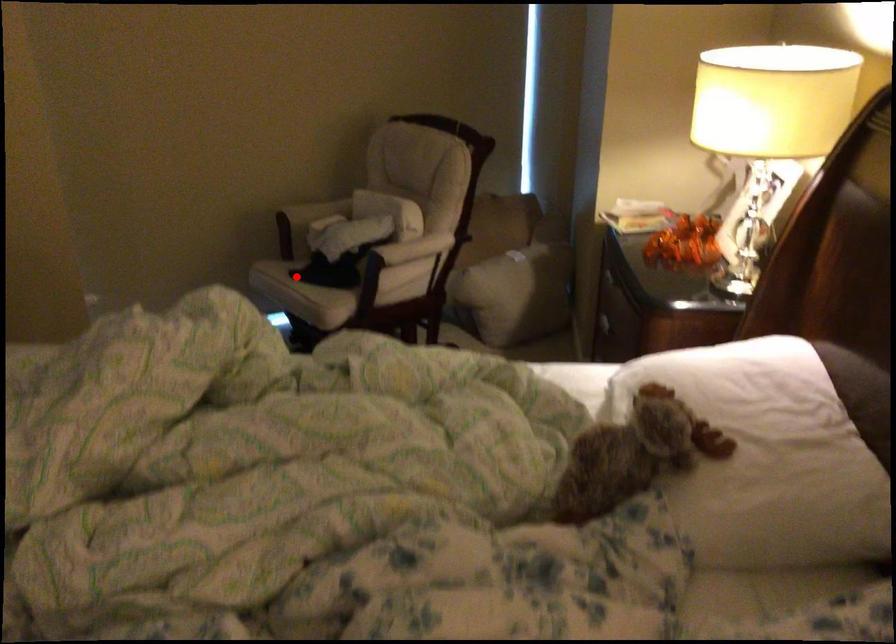
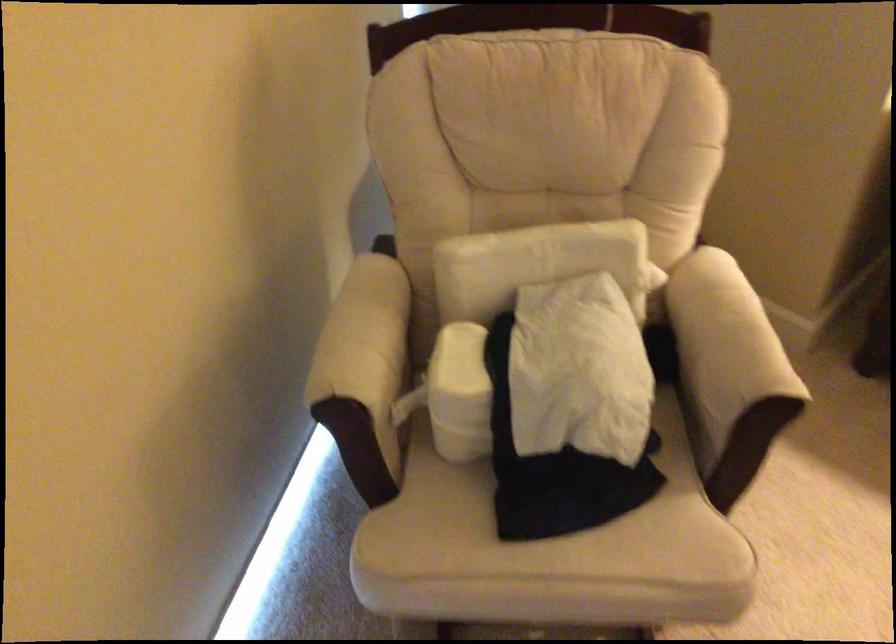
Question: I am providing you with two images of the same scene from different viewpoints. A red point is shown in image1. For the corresponding object point in image2, is it positioned nearer or farther from the camera?

Choices:
 (A) Nearer
 (B) Farther

Answer: (A)